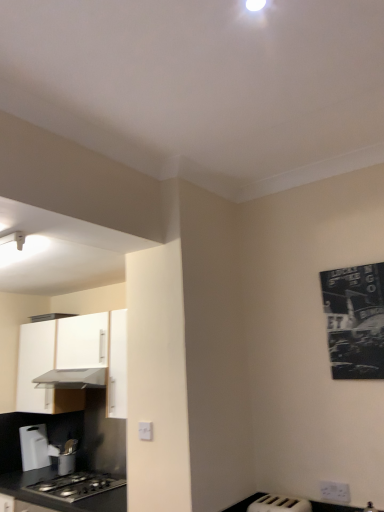
Question: Does black matte countertop at lower left have a smaller size compared to metallic silver utensil holder at lower left, which ranks as the 1th appliance in left-to-right order?

Choices:
 (A) yes
 (B) no

Answer: (B)

Question: Is black matte countertop at lower left oriented away from metallic silver utensil holder at lower left, which ranks as the 1th appliance in left-to-right order?

Choices:
 (A) yes
 (B) no

Answer: (B)

Question: From the image's perspective, is black matte countertop at lower left below metallic silver utensil holder at lower left, the second appliance when ordered from top to bottom?

Choices:
 (A) no
 (B) yes

Answer: (B)

Question: Is black matte countertop at lower left outside metallic silver utensil holder at lower left, which ranks as the second appliance in front-to-back order?

Choices:
 (A) yes
 (B) no

Answer: (A)

Question: Can you confirm if black matte countertop at lower left is positioned to the left of metallic silver utensil holder at lower left, which is the 2th appliance in right-to-left order?

Choices:
 (A) yes
 (B) no

Answer: (B)

Question: Is black matte countertop at lower left taller or shorter than white plastic toaster at lower right, the 1th appliance viewed from the top?

Choices:
 (A) tall
 (B) short

Answer: (B)

Question: Considering the positions of black matte countertop at lower left and white plastic toaster at lower right, the 1th appliance viewed from the top, in the image, is black matte countertop at lower left bigger or smaller than white plastic toaster at lower right, the 1th appliance viewed from the top,?

Choices:
 (A) small
 (B) big

Answer: (B)

Question: Choose the correct answer: Is black matte countertop at lower left inside white plastic toaster at lower right, which appears as the first appliance when viewed from the right, or outside it?

Choices:
 (A) outside
 (B) inside

Answer: (A)

Question: From the image's perspective, is black matte countertop at lower left located above or below white plastic toaster at lower right, the 1th appliance viewed from the top?

Choices:
 (A) below
 (B) above

Answer: (A)

Question: Considering their positions, is white plastic electric outlet at lower center, which ranks as the 2th electric outlet in bottom-to-top order, located in front of or behind white matte cabinet at left?

Choices:
 (A) front
 (B) behind

Answer: (A)

Question: In terms of size, does white plastic electric outlet at lower center, arranged as the 1th electric outlet when viewed from the top, appear bigger or smaller than white matte cabinet at left?

Choices:
 (A) big
 (B) small

Answer: (B)

Question: Is white plastic electric outlet at lower center, arranged as the 1th electric outlet when viewed from the top, inside the boundaries of white matte cabinet at left, or outside?

Choices:
 (A) inside
 (B) outside

Answer: (B)

Question: From a real-world perspective, is white plastic electric outlet at lower center, positioned as the 1th electric outlet in left-to-right order, physically located above or below white matte cabinet at left?

Choices:
 (A) above
 (B) below

Answer: (B)

Question: Is white plastic toaster at lower right, which appears as the first appliance when viewed from the right, bigger or smaller than white plastic electric outlet at lower right, which is the 1th electric outlet in bottom-to-top order?

Choices:
 (A) big
 (B) small

Answer: (A)

Question: Looking at their shapes, would you say white plastic toaster at lower right, the 2th appliance when ordered from bottom to top, is wider or thinner than white plastic electric outlet at lower right, which is the 1th electric outlet in bottom-to-top order?

Choices:
 (A) wide
 (B) thin

Answer: (A)